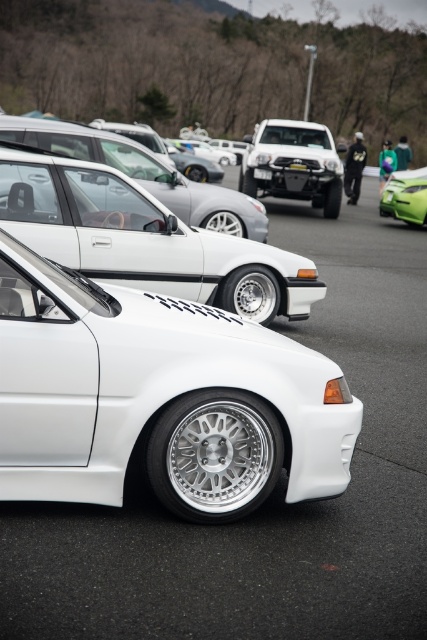
Is white matte sedan at center in front of matte black truck at center?

That is True.

Is white matte sedan at center to the left of matte black truck at center from the viewer's perspective?

Indeed, white matte sedan at center is positioned on the left side of matte black truck at center.

Locate an element on the screen. The image size is (427, 640). white matte sedan at center is located at coordinates (145, 240).

Does green matte sports car at right appear on the left side of white plastic license plate at center?

In fact, green matte sports car at right is to the right of white plastic license plate at center.

Between green matte sports car at right and white plastic license plate at center, which one has less height?

white plastic license plate at center is shorter.

The height and width of the screenshot is (640, 427). Identify the location of green matte sports car at right. (406, 196).

Where is `satin silver car at center`? satin silver car at center is located at coordinates (145, 173).

Between satin silver car at center and black plastic license plate at center, which one is positioned lower?

satin silver car at center is below.

Is point (177, 216) positioned in front of point (304, 170)?

That is True.

Image resolution: width=427 pixels, height=640 pixels. In order to click on satin silver car at center in this screenshot , I will do (x=145, y=173).